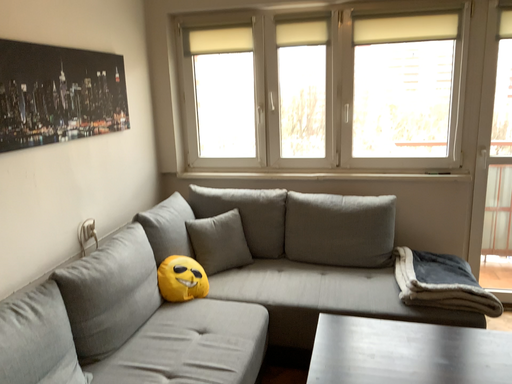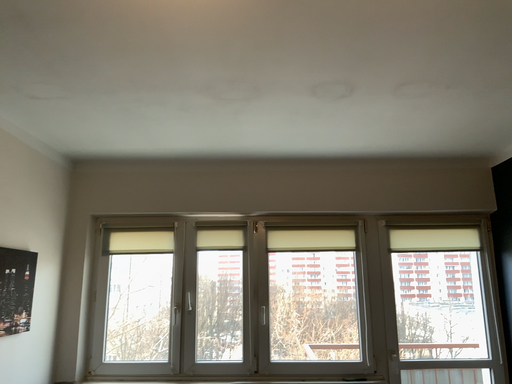
Question: How did the camera likely rotate when shooting the video?

Choices:
 (A) rotated downward
 (B) rotated upward

Answer: (B)